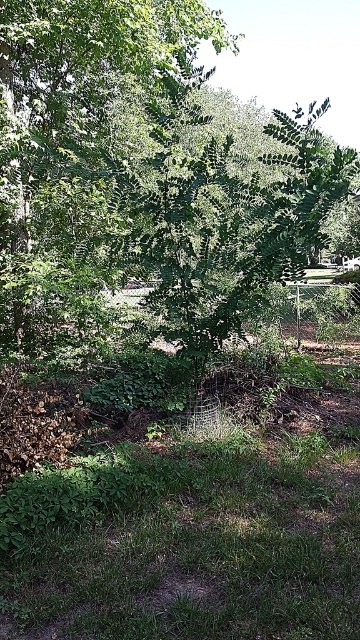
Question: Which point is closer to the camera taking this photo?

Choices:
 (A) (132, 192)
 (B) (114, 589)

Answer: (B)

Question: Is the position of green leafy tree at center less distant than that of green grass at lower center?

Choices:
 (A) yes
 (B) no

Answer: (B)

Question: Which of the following is the farthest from the observer?

Choices:
 (A) (160, 298)
 (B) (267, 580)

Answer: (A)

Question: Does green leafy tree at center appear on the left side of green grass at lower center?

Choices:
 (A) yes
 (B) no

Answer: (B)

Question: Can you confirm if green leafy tree at center is positioned to the right of green grass at lower center?

Choices:
 (A) no
 (B) yes

Answer: (B)

Question: Which object is farther from the camera taking this photo?

Choices:
 (A) green grass at lower center
 (B) green leafy tree at center

Answer: (B)